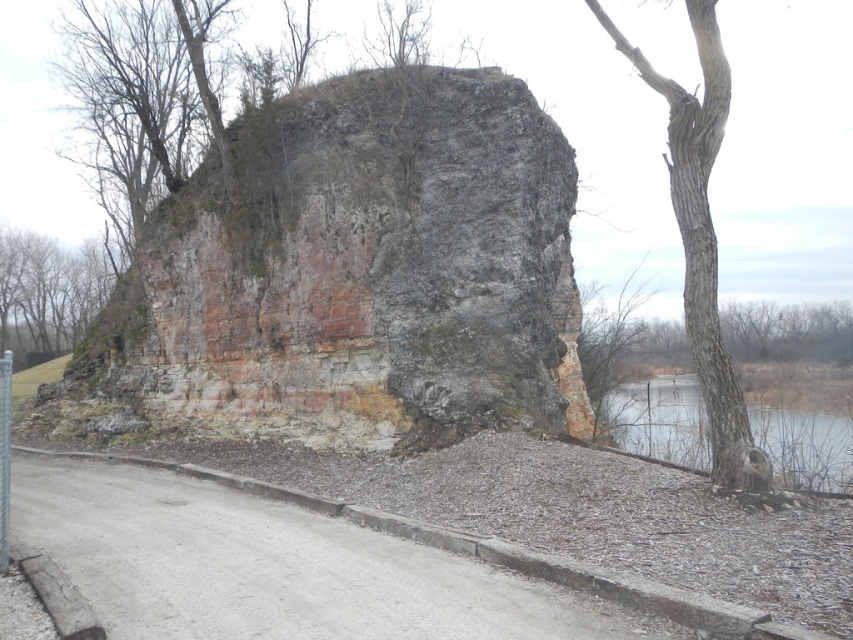
You are a hiker standing on the pathway in front of the rusty stone cliff at center. You want to take a photo of the bare branches at right without the cliff blocking the view. Is the cliff in the way of the branches?

The rusty stone cliff at center is positioned over the bare branches at right, so it is blocking the view of the branches. To take a photo without the cliff, you would need to move to a position where the cliff is no longer between you and the branches.